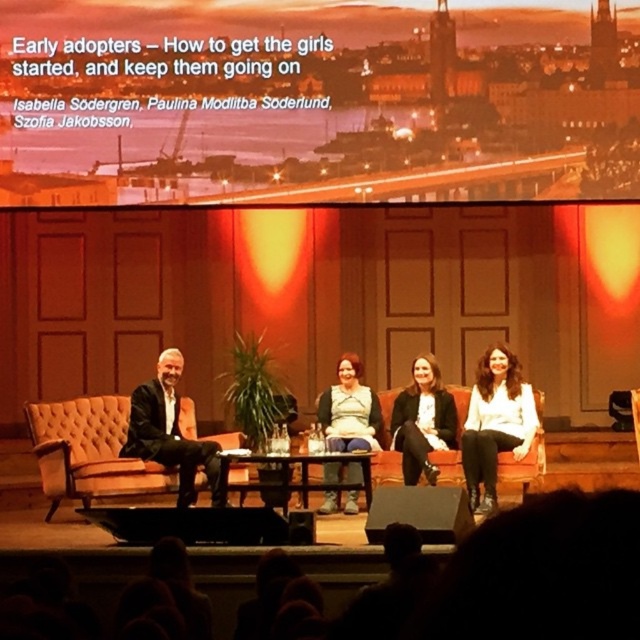
Which of these two, white matte shirt at center or matte green dress at center, stands taller?

matte green dress at center is taller.

Between white matte shirt at center and matte green dress at center, which one is positioned higher?

matte green dress at center is above.

Which is behind, point (502, 356) or point (349, 380)?

Positioned behind is point (349, 380).

This screenshot has width=640, height=640. I want to click on white matte shirt at center, so click(x=496, y=422).

What do you see at coordinates (170, 429) in the screenshot? The image size is (640, 640). I see `black leather jacket at left` at bounding box center [170, 429].

Does point (145, 388) come closer to viewer compared to point (428, 420)?

Yes.

Where is `black leather jacket at left`? black leather jacket at left is located at coordinates click(170, 429).

Is point (336, 412) in front of point (307, 493)?

No, it is behind (307, 493).

Who is lower down, matte green dress at center or wooden at center?

Positioned lower is wooden at center.

Where is `matte green dress at center`? matte green dress at center is located at coordinates (349, 410).